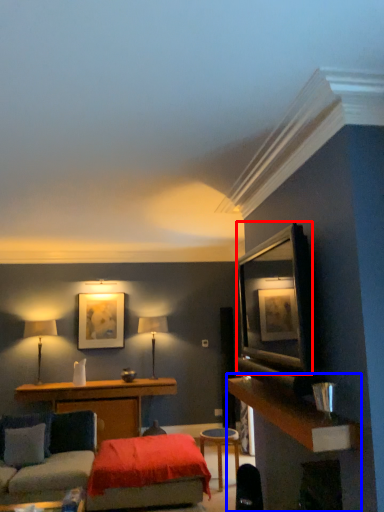
Question: Among these objects, which one is farthest to the camera, shelf (highlighted by a red box) or dresser (highlighted by a blue box)?

Choices:
 (A) shelf
 (B) dresser

Answer: (A)